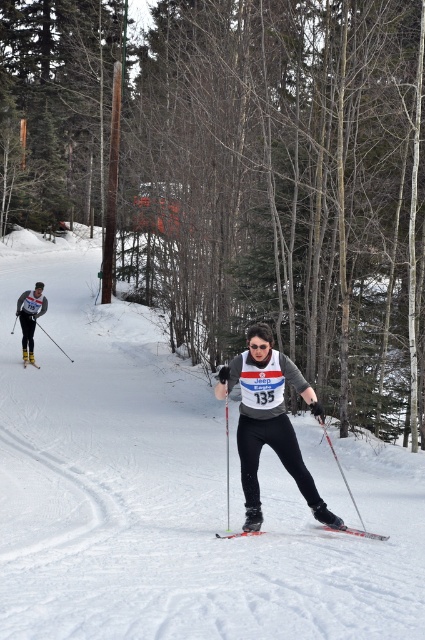
Question: Does matte gray ski suit at center appear over matte black ski pole at left?

Choices:
 (A) yes
 (B) no

Answer: (B)

Question: Among these points, which one is farthest from the camera?

Choices:
 (A) coord(363,536)
 (B) coord(351,493)
 (C) coord(376,452)

Answer: (C)

Question: Does white snow ski slope at center have a greater width compared to matte black ski pole at left?

Choices:
 (A) no
 (B) yes

Answer: (B)

Question: Does bare wood tree at center appear over yellow metallic ski at center?

Choices:
 (A) no
 (B) yes

Answer: (B)

Question: Which point is closer to the camera?

Choices:
 (A) matte black skisuit at left
 (B) yellow metallic ski at center
 (C) red metallic ski at center
 (D) matte black ski pole at left

Answer: (C)

Question: Which object appears farthest from the camera in this image?

Choices:
 (A) matte black ski pole at center
 (B) metallic silver ski at center

Answer: (B)